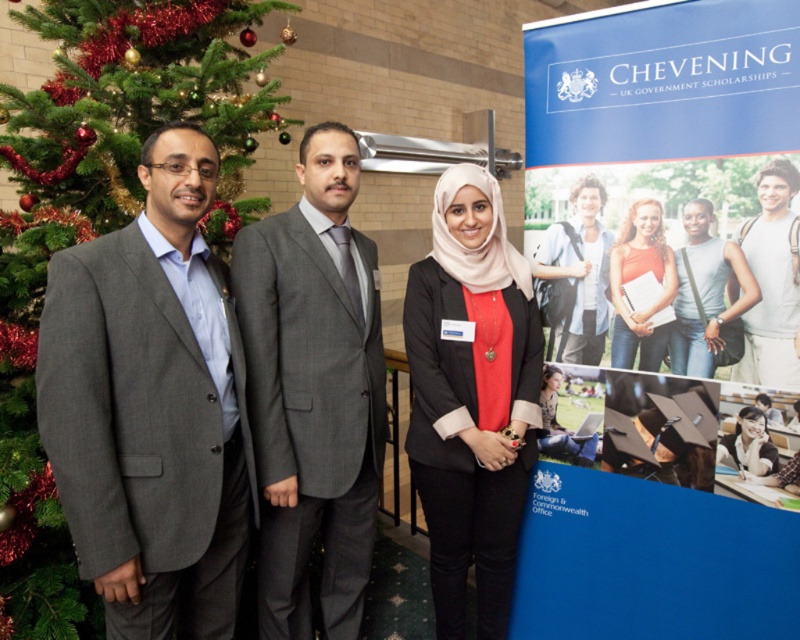
You are organizing a charity event and need to determine which clothing item to display first based on size. Given the light blue denim shirt at center and the matte gray tank top at center, which one should you choose if you want to start with the larger item?

The light blue denim shirt at center is larger in size than the matte gray tank top at center, so you should choose the light blue denim shirt at center to display first.

You are organizing a photo shoot and need to ensure that the matte pink hijab at center and the matte orange tank top at center are positioned at least 4 inches apart for better visibility. Based on the current arrangement shown in the image, is this requirement met?

The matte pink hijab at center and the matte orange tank top at center are currently 3.47 inches apart, which is less than the required 4 inches. Therefore, the requirement is not met and they need to be moved further apart.